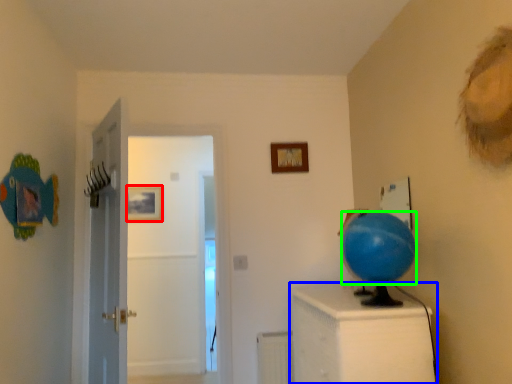
Question: Based on their relative distances, which object is nearer to picture frame (highlighted by a red box)? Choose from furniture (highlighted by a blue box) and balloon (highlighted by a green box).

Choices:
 (A) furniture
 (B) balloon

Answer: (A)